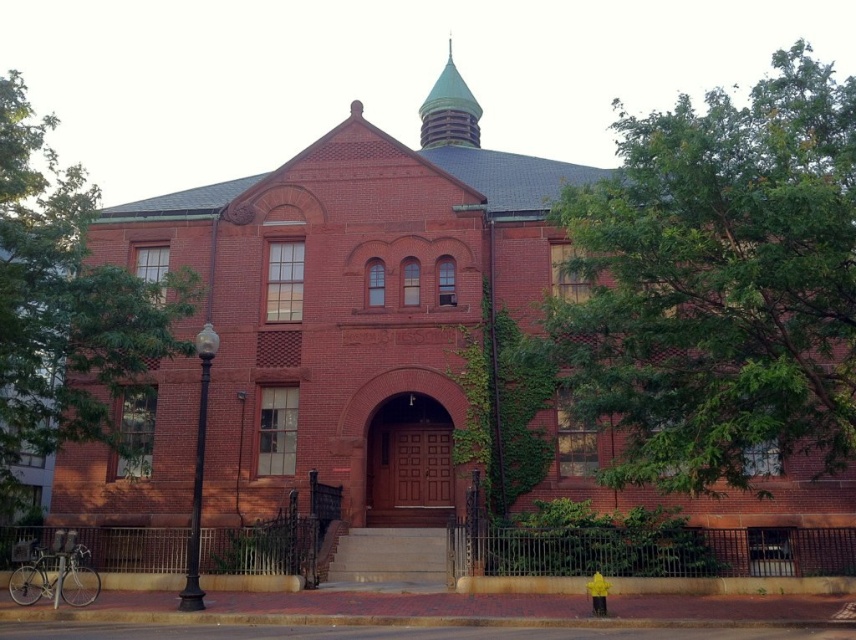
You are standing in front of the historic red brick building and want to determine which object is taller between the green leafy tree at upper right and the green copper spire at upper center. Based on the scene, which one is taller?

The green leafy tree at upper right is taller than the green copper spire at upper center.

Based on the scene description, where is the green leafy tree at upper right located in terms of its 2D coordinates?

The green leafy tree at upper right is located at the 2D coordinates of point (718, 284).